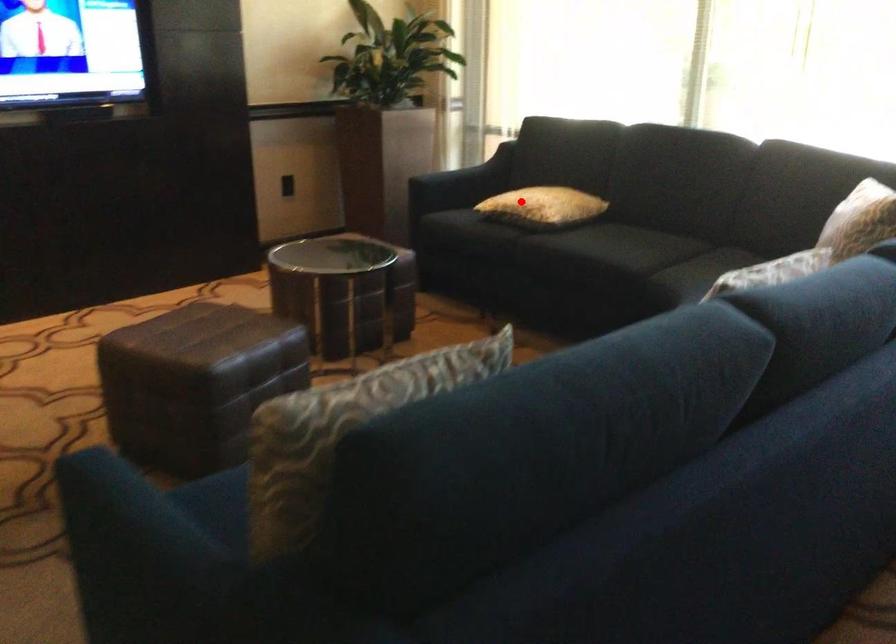
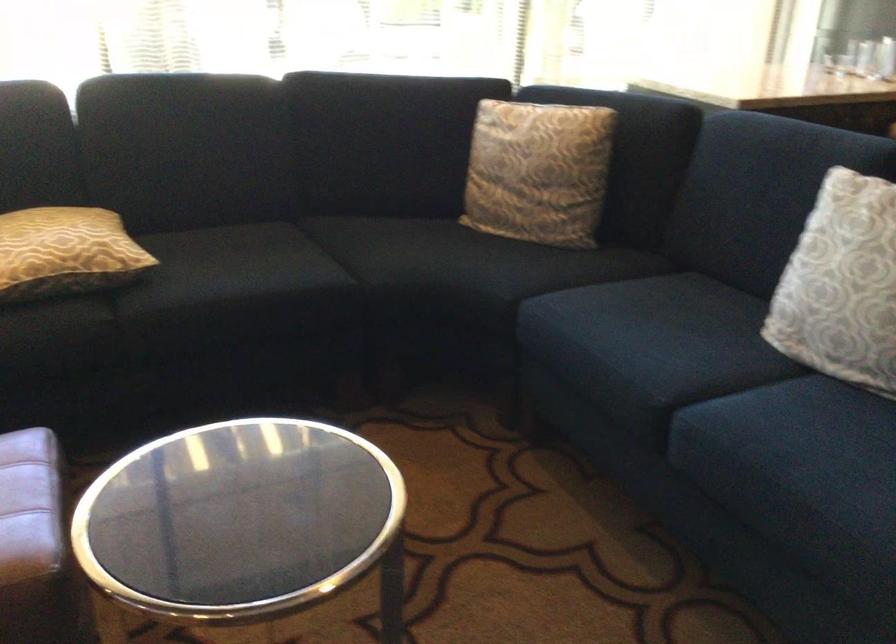
In the second image, find the point that corresponds to the highlighted location in the first image.

(65, 252)